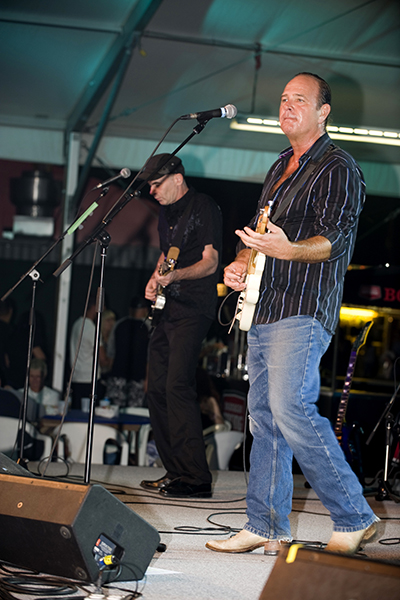
Find the location of a particular element. The width and height of the screenshot is (400, 600). cables is located at coordinates (217, 521), (148, 500).